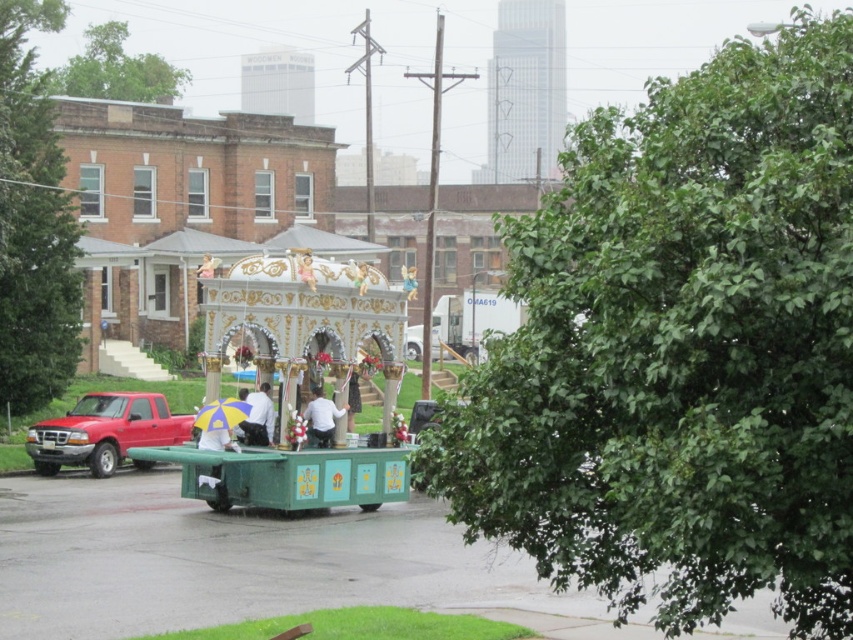
Can you confirm if green painted wood cart at center is thinner than white matte shirt at center?

Incorrect, green painted wood cart at center's width is not less than white matte shirt at center's.

Does green painted wood cart at center have a greater height compared to white matte shirt at center?

Yes.

Is point (242, 449) positioned behind point (310, 420)?

No, it is in front of (310, 420).

Find the location of a particular element. The height and width of the screenshot is (640, 853). green painted wood cart at center is located at coordinates (288, 476).

In the scene shown: Between matte red truck at left and golden ornate angel at center, which one has more height?

golden ornate angel at center is taller.

Does matte red truck at left lie in front of golden ornate angel at center?

No, matte red truck at left is further to the viewer.

Who is more distant from viewer, (x=44, y=445) or (x=408, y=285)?

The point (x=44, y=445) is more distant.

Where is `matte red truck at left`? Image resolution: width=853 pixels, height=640 pixels. matte red truck at left is located at coordinates (103, 432).

Who is taller, matte red truck at left or white matte shirt at center?

Standing taller between the two is matte red truck at left.

Does matte red truck at left have a smaller size compared to white matte shirt at center?

Actually, matte red truck at left might be larger than white matte shirt at center.

Based on the photo, who is more distant from viewer, (53, 448) or (326, 420)?

The point (53, 448) is more distant.

You are a GUI agent. You are given a task and a screenshot of the screen. Output one action in this format:
    pyautogui.click(x=<x>, y=<y>)
    Task: Click on the matte red truck at left
    
    Given the screenshot: What is the action you would take?
    pyautogui.click(x=103, y=432)